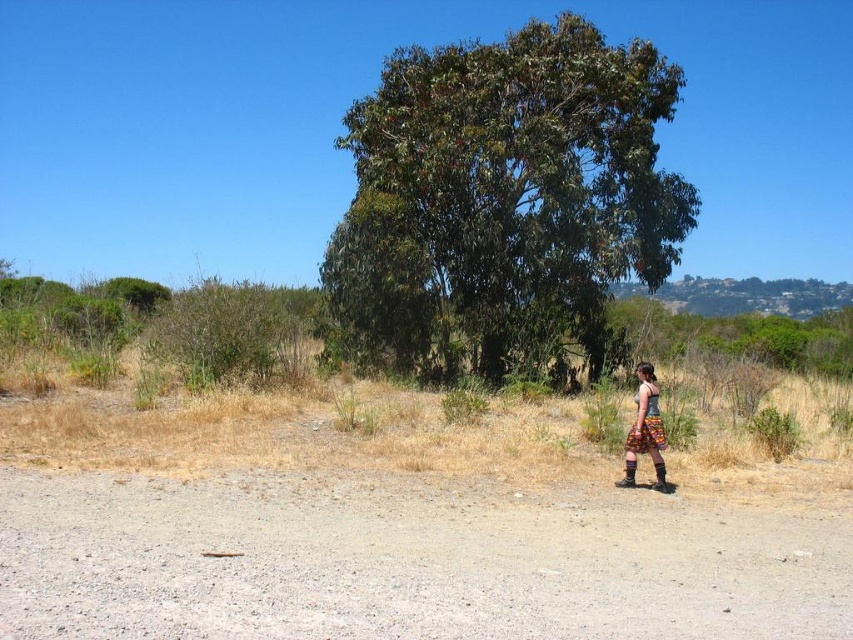
Question: Estimate the real-world distances between objects in this image. Which object is farther from the green leafy tree at center?

Choices:
 (A) printed fabric skirt at lower right
 (B) gray gravel dirt track at lower center

Answer: (B)

Question: Is gray gravel dirt track at lower center smaller than printed fabric skirt at lower right?

Choices:
 (A) yes
 (B) no

Answer: (A)

Question: Does gray gravel dirt track at lower center lie in front of printed fabric skirt at lower right?

Choices:
 (A) yes
 (B) no

Answer: (A)

Question: Which object appears closest to the camera in this image?

Choices:
 (A) gray gravel dirt track at lower center
 (B) green leafy tree at center

Answer: (A)

Question: Which point is closer to the camera taking this photo?

Choices:
 (A) (798, 525)
 (B) (646, 420)

Answer: (A)

Question: Does green leafy tree at center appear under printed fabric skirt at lower right?

Choices:
 (A) no
 (B) yes

Answer: (A)